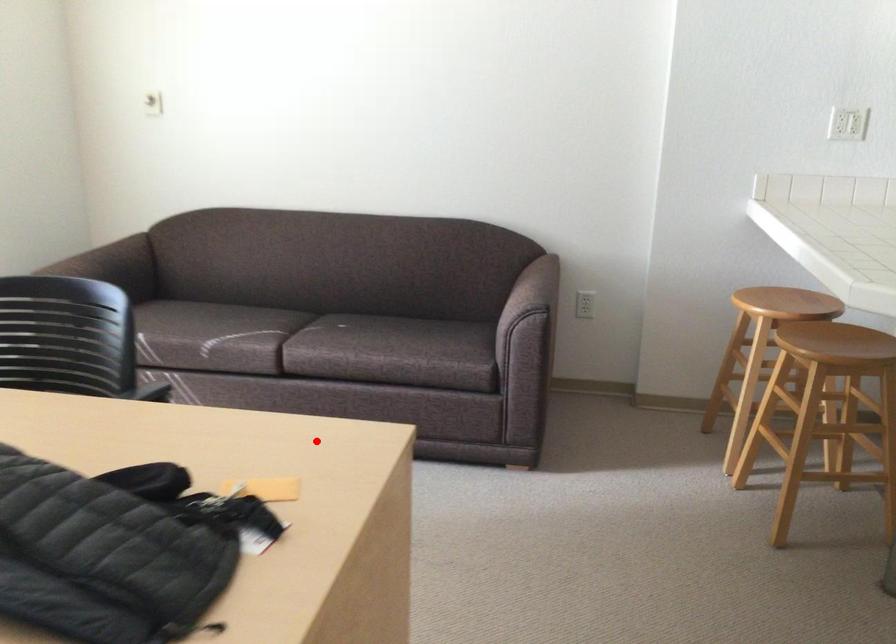
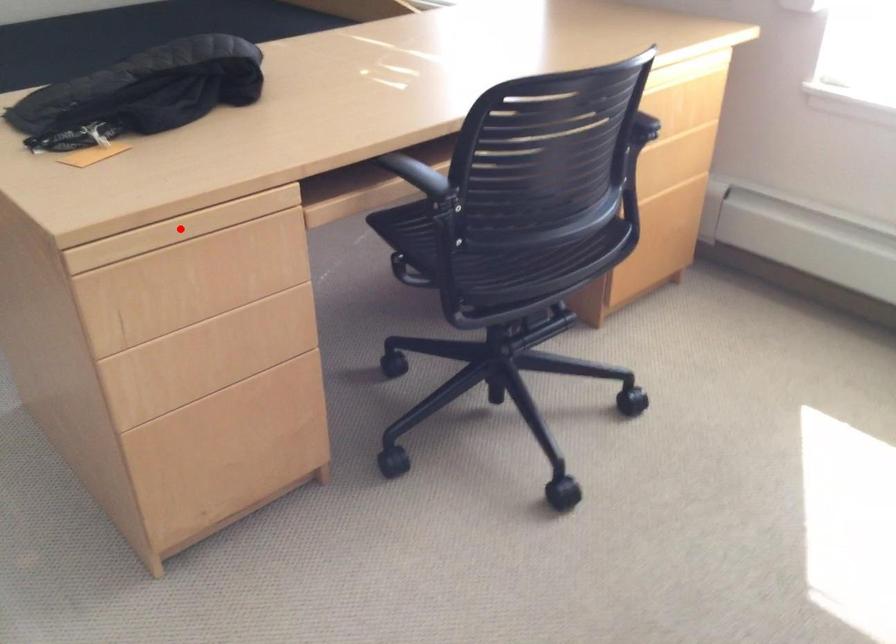
I am providing you with two images of the same scene from different viewpoints. A red point is marked on the first image and another point is marked on the second image. Is the red point in image1 aligned with the point shown in image2?

Yes